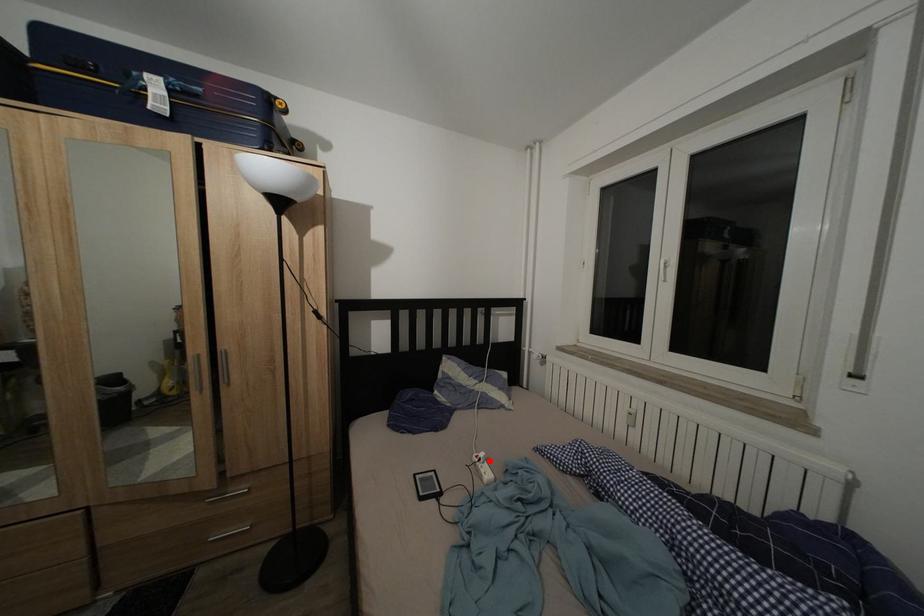
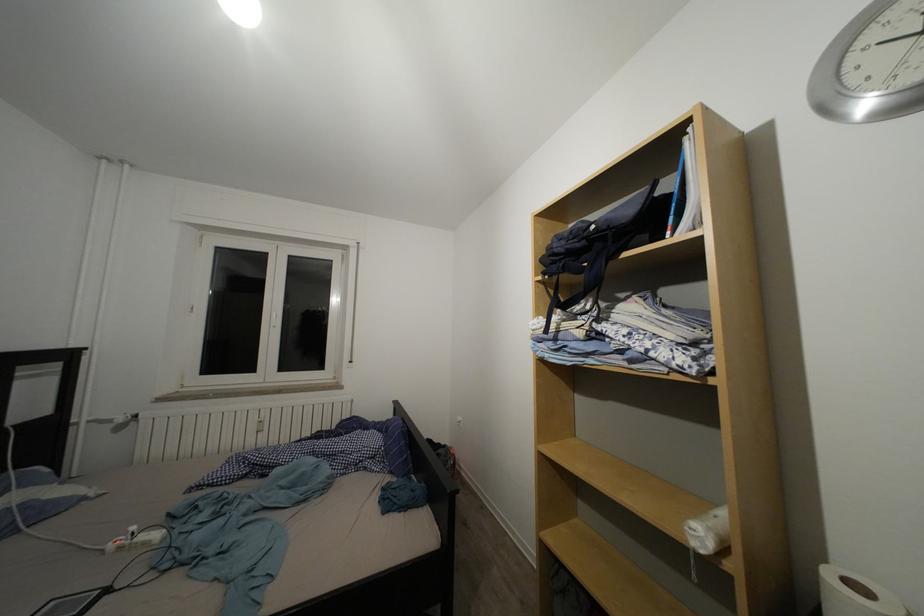
In the second image, find the point that corresponds to the highlighted location in the first image.

(140, 533)